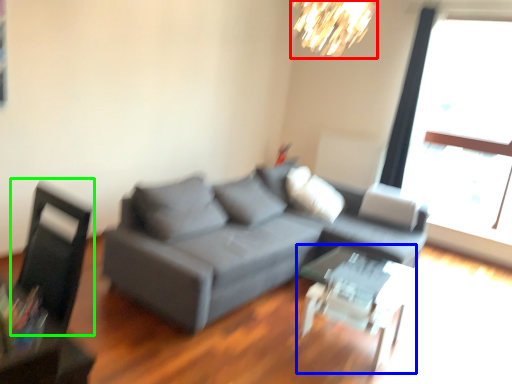
Question: Which is nearer to the lamp (highlighted by a red box)? table (highlighted by a blue box) or swivel chair (highlighted by a green box).

Choices:
 (A) table
 (B) swivel chair

Answer: (A)